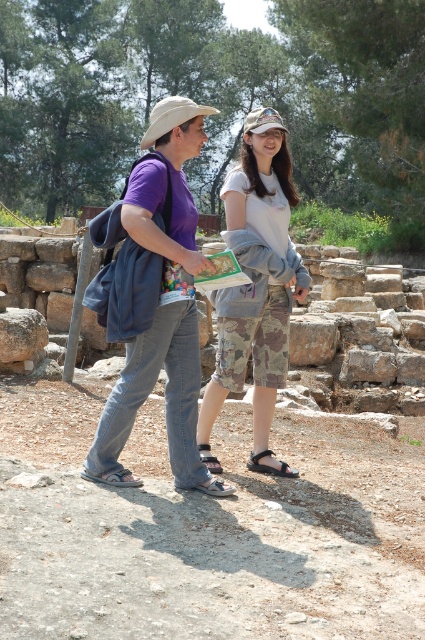
You are a tour guide at this historical site and need to ensure visitors can distinguish between the two tourists based on their clothing. Which clothing item is larger in size between the purple cotton shirt at center and the camo fabric shorts at center?

The purple cotton shirt at center is larger than the camo fabric shorts at center.

You are a tour guide at the historical site and need to ensure visitors are following the dress code, which requires all clothing items to be no wider than 30 cm. You observe the purple cotton shirt at center and the camo shorts at center. Can both items comply with the dress code?

The purple cotton shirt at center is wider than the camo shorts at center. Since the dress code restricts clothing items to 30 cm or less in width, the purple cotton shirt at center likely exceeds the limit, while the camo shorts at center may comply. However, without exact measurements, it is uncertain if both items meet the requirements.